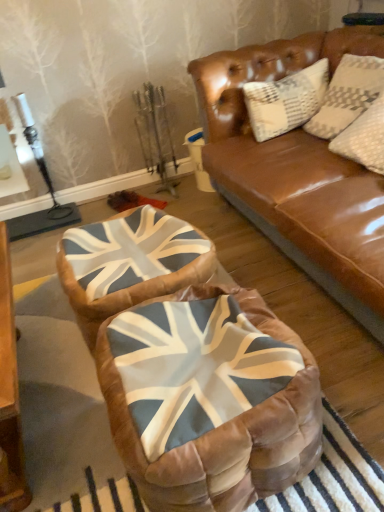
The height and width of the screenshot is (512, 384). What do you see at coordinates (129, 264) in the screenshot?
I see `union jack fabric swivel chair at center` at bounding box center [129, 264].

Where is `union jack fabric swivel chair at center`? union jack fabric swivel chair at center is located at coordinates (129, 264).

The width and height of the screenshot is (384, 512). What are the coordinates of `velvet union jack bean bag at center` in the screenshot? It's located at (191, 369).

Looking at this image, in order to face velvet union jack bean bag at center, should I rotate leftwards or rightwards?

Rotate right and turn 2.555 degrees.

What do you see at coordinates (191, 369) in the screenshot?
I see `velvet union jack bean bag at center` at bounding box center [191, 369].

What is the approximate height of velvet union jack bean bag at center?

It is 15.20 inches.

Where is `union jack fabric swivel chair at center`? union jack fabric swivel chair at center is located at coordinates (129, 264).

Is union jack fabric swivel chair at center at the left side of velvet union jack bean bag at center?

Yes.

Considering their positions, is union jack fabric swivel chair at center located in front of or behind velvet union jack bean bag at center?

Visually, union jack fabric swivel chair at center is located behind velvet union jack bean bag at center.

Is point (111, 297) more distant than point (229, 487)?

Yes, it is behind point (229, 487).

From the image's perspective, does union jack fabric swivel chair at center appear lower than velvet union jack bean bag at center?

Incorrect, from the image's perspective, union jack fabric swivel chair at center is higher than velvet union jack bean bag at center.

From a real-world perspective, is union jack fabric swivel chair at center positioned above or below velvet union jack bean bag at center?

In terms of real-world spatial position, union jack fabric swivel chair at center is below velvet union jack bean bag at center.

Based on the photo, is union jack fabric swivel chair at center wider than velvet union jack bean bag at center?

Incorrect, the width of union jack fabric swivel chair at center does not surpass that of velvet union jack bean bag at center.

In the scene shown: Considering the relative sizes of union jack fabric swivel chair at center and velvet union jack bean bag at center in the image provided, is union jack fabric swivel chair at center shorter than velvet union jack bean bag at center?

Yes.

In terms of size, does union jack fabric swivel chair at center appear bigger or smaller than velvet union jack bean bag at center?

Clearly, union jack fabric swivel chair at center is smaller in size than velvet union jack bean bag at center.

Is union jack fabric swivel chair at center not inside velvet union jack bean bag at center?

Yes, union jack fabric swivel chair at center is not within velvet union jack bean bag at center.

Is union jack fabric swivel chair at center touching velvet union jack bean bag at center?

union jack fabric swivel chair at center is not next to velvet union jack bean bag at center, and they're not touching.

Is union jack fabric swivel chair at center facing towards velvet union jack bean bag at center?

No, union jack fabric swivel chair at center is not oriented towards velvet union jack bean bag at center.

How different are the orientations of union jack fabric swivel chair at center and velvet union jack bean bag at center in degrees?

The angle between the facing direction of union jack fabric swivel chair at center and the facing direction of velvet union jack bean bag at center is 6.73 degrees.

You are a GUI agent. You are given a task and a screenshot of the screen. Output one action in this format:
    pyautogui.click(x=<x>, y=<y>)
    Task: Click on the swivel chair that appears above the velvet union jack bean bag at center (from the image's perspective)
    The height and width of the screenshot is (512, 384).
    Given the screenshot: What is the action you would take?
    pyautogui.click(x=129, y=264)

Between velvet union jack bean bag at center and union jack fabric swivel chair at center, which one appears on the right side from the viewer's perspective?

velvet union jack bean bag at center is more to the right.

Does velvet union jack bean bag at center come behind union jack fabric swivel chair at center?

No, it is not.

Does point (181, 352) appear closer or farther from the camera than point (111, 247)?

Point (181, 352).

From the image's perspective, would you say velvet union jack bean bag at center is shown under union jack fabric swivel chair at center?

Yes, from the image's perspective, velvet union jack bean bag at center is beneath union jack fabric swivel chair at center.

From a real-world perspective, does velvet union jack bean bag at center stand above union jack fabric swivel chair at center?

Yes, from a real-world perspective, velvet union jack bean bag at center is on top of union jack fabric swivel chair at center.

Which object is thinner, velvet union jack bean bag at center or union jack fabric swivel chair at center?

union jack fabric swivel chair at center is thinner.

Considering the sizes of objects velvet union jack bean bag at center and union jack fabric swivel chair at center in the image provided, who is taller, velvet union jack bean bag at center or union jack fabric swivel chair at center?

velvet union jack bean bag at center is taller.

In the scene shown: Who is bigger, velvet union jack bean bag at center or union jack fabric swivel chair at center?

Bigger between the two is velvet union jack bean bag at center.

Is velvet union jack bean bag at center situated inside union jack fabric swivel chair at center or outside?

velvet union jack bean bag at center exists outside the volume of union jack fabric swivel chair at center.

Is velvet union jack bean bag at center touching union jack fabric swivel chair at center?

No, velvet union jack bean bag at center is not with union jack fabric swivel chair at center.

Is velvet union jack bean bag at center oriented away from union jack fabric swivel chair at center?

velvet union jack bean bag at center is not turned away from union jack fabric swivel chair at center.

Can you tell me how much velvet union jack bean bag at center and union jack fabric swivel chair at center differ in facing direction?

They differ by 6.73 degrees in their facing directions.

Locate an element on the screen. This screenshot has width=384, height=512. bean bag chair on the right of union jack fabric swivel chair at center is located at coordinates (191, 369).

In order to click on swivel chair that appears below the velvet union jack bean bag at center (from a real-world perspective) in this screenshot , I will do 129,264.

Find the location of `bean bag chair above the union jack fabric swivel chair at center (from a real-world perspective)`. bean bag chair above the union jack fabric swivel chair at center (from a real-world perspective) is located at coordinates (191, 369).